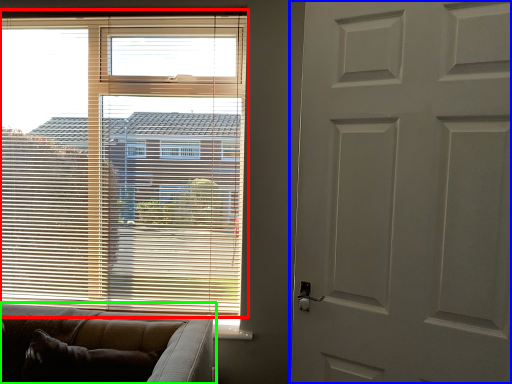
Question: Which object is the farthest from window blind (highlighted by a red box)? Choose among these: door (highlighted by a blue box) or studio couch (highlighted by a green box).

Choices:
 (A) door
 (B) studio couch

Answer: (A)